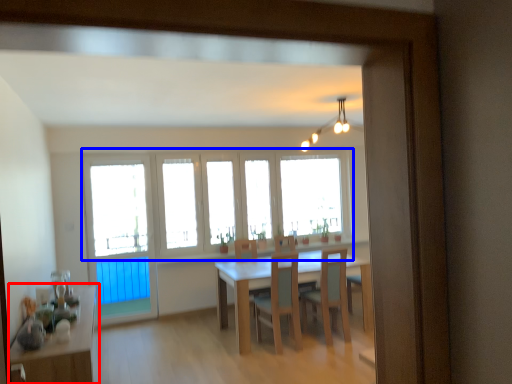
Question: Which point is further to the camera, table (highlighted by a red box) or window (highlighted by a blue box)?

Choices:
 (A) table
 (B) window

Answer: (B)